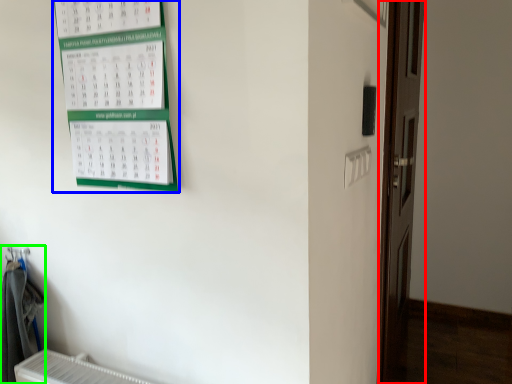
Question: Which object is the farthest from door (highlighted by a red box)? Choose among these: bulletin board (highlighted by a blue box) or laundry (highlighted by a green box).

Choices:
 (A) bulletin board
 (B) laundry

Answer: (B)